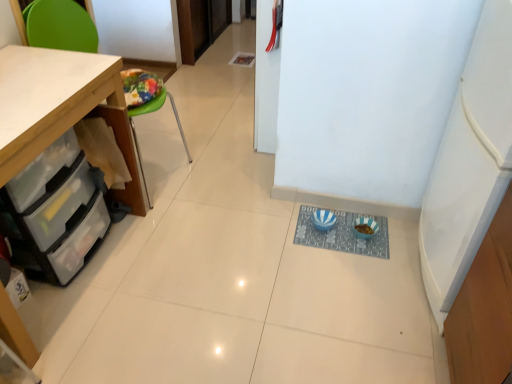
Describe the element at coordinates (342, 234) in the screenshot. The image size is (512, 384). I see `blue striped bowls at center` at that location.

What do you see at coordinates (59, 26) in the screenshot? This screenshot has width=512, height=384. I see `green plastic chair at left` at bounding box center [59, 26].

Locate an element on the screen. This screenshot has height=384, width=512. clear plastic drawers at lower left is located at coordinates (55, 212).

Image resolution: width=512 pixels, height=384 pixels. In order to click on blue striped bowls at center in this screenshot , I will do `click(342, 234)`.

Can you tell me how much wooden cabinet at left and clear plastic drawers at lower left differ in facing direction?

0.103 degrees.

Considering the sizes of objects wooden cabinet at left and clear plastic drawers at lower left in the image provided, who is wider, wooden cabinet at left or clear plastic drawers at lower left?

clear plastic drawers at lower left is wider.

Would you say wooden cabinet at left is a long distance from clear plastic drawers at lower left?

No.

The height and width of the screenshot is (384, 512). In order to click on drawer that is on the left side of wooden cabinet at left in this screenshot , I will do `click(55, 212)`.

Consider the image. Can you confirm if wooden cabinet at left is taller than green plastic chair at left?

No.

Which object is thinner, wooden cabinet at left or green plastic chair at left?

wooden cabinet at left.

You are a GUI agent. You are given a task and a screenshot of the screen. Output one action in this format:
    pyautogui.click(x=<x>, y=<y>)
    Task: Click on the chair behind the wooden cabinet at left
    This screenshot has height=384, width=512.
    Given the screenshot: What is the action you would take?
    pyautogui.click(x=59, y=26)

Is wooden cabinet at left not inside green plastic chair at left?

Indeed, wooden cabinet at left is completely outside green plastic chair at left.

Based on their positions, is blue striped bowls at center located to the left or right of clear plastic drawers at lower left?

Clearly, blue striped bowls at center is on the right of clear plastic drawers at lower left in the image.

Does blue striped bowls at center have a greater width compared to clear plastic drawers at lower left?

In fact, blue striped bowls at center might be narrower than clear plastic drawers at lower left.

From a real-world perspective, is blue striped bowls at center positioned above or below clear plastic drawers at lower left?

→ blue striped bowls at center is situated lower than clear plastic drawers at lower left in the real world.

Is green plastic chair at left positioned beyond the bounds of clear plastic drawers at lower left?

Yes, green plastic chair at left is located beyond the bounds of clear plastic drawers at lower left.

From a real-world perspective, which object stands above the other?

From a 3D spatial view, green plastic chair at left is above.

Where is `chair behind the clear plastic drawers at lower left`? chair behind the clear plastic drawers at lower left is located at coordinates (59, 26).

Which of these two, green plastic chair at left or clear plastic drawers at lower left, stands shorter?

With less height is clear plastic drawers at lower left.

Is wooden cabinet at left next to blue striped bowls at center and touching it?

No.

Can you confirm if wooden cabinet at left is bigger than blue striped bowls at center?

Yes.

Considering the sizes of objects wooden cabinet at left and blue striped bowls at center in the image provided, who is taller, wooden cabinet at left or blue striped bowls at center?

With more height is wooden cabinet at left.

From the image's perspective, between wooden cabinet at left and blue striped bowls at center, which one is located above?

From the image's view, wooden cabinet at left is above.

Is green plastic chair at left to the left or to the right of wooden cabinet at left in the image?

green plastic chair at left is positioned on wooden cabinet at left's right side.

Is point (74, 7) closer to camera compared to point (40, 65)?

No.

From a real-world perspective, is green plastic chair at left located higher than wooden cabinet at left?

Yes.

In the scene shown: Is green plastic chair at left aimed at wooden cabinet at left?

No, green plastic chair at left is not facing towards wooden cabinet at left.

From the image's perspective, is blue striped bowls at center above or below wooden cabinet at left?

blue striped bowls at center is situated lower than wooden cabinet at left in the image.

Is blue striped bowls at center bigger than wooden cabinet at left?

Actually, blue striped bowls at center might be smaller than wooden cabinet at left.

Considering the positions of objects blue striped bowls at center and wooden cabinet at left in the image provided, who is more to the left, blue striped bowls at center or wooden cabinet at left?

From the viewer's perspective, wooden cabinet at left appears more on the left side.

The width and height of the screenshot is (512, 384). Find the location of `cabinetry located on the right of clear plastic drawers at lower left`. cabinetry located on the right of clear plastic drawers at lower left is located at coordinates pos(55,102).

You are a GUI agent. You are given a task and a screenshot of the screen. Output one action in this format:
    pyautogui.click(x=<x>, y=<y>)
    Task: Click on the cabinetry in front of the green plastic chair at left
    The image size is (512, 384).
    Given the screenshot: What is the action you would take?
    pyautogui.click(x=55, y=102)

From the picture: When comparing their distances from green plastic chair at left, does wooden cabinet at left or blue striped bowls at center seem closer?

Among the two, wooden cabinet at left is located nearer to green plastic chair at left.

When comparing their distances from blue striped bowls at center, does green plastic chair at left or wooden cabinet at left seem closer?

wooden cabinet at left.

Estimate the real-world distances between objects in this image. Which object is closer to green plastic chair at left, clear plastic drawers at lower left or blue striped bowls at center?

Among the two, clear plastic drawers at lower left is located nearer to green plastic chair at left.

Based on their spatial positions, is blue striped bowls at center or wooden cabinet at left further from green plastic chair at left?

Based on the image, blue striped bowls at center appears to be further to green plastic chair at left.

Which object lies further to the anchor point clear plastic drawers at lower left, wooden cabinet at left or blue striped bowls at center?

Among the two, blue striped bowls at center is located further to clear plastic drawers at lower left.

Which object lies nearer to the anchor point blue striped bowls at center, clear plastic drawers at lower left or green plastic chair at left?

clear plastic drawers at lower left is closer to blue striped bowls at center.

Looking at the image, which one is located further to blue striped bowls at center, clear plastic drawers at lower left or wooden cabinet at left?

wooden cabinet at left.

Which object lies further to the anchor point wooden cabinet at left, green plastic chair at left or clear plastic drawers at lower left?

Based on the image, green plastic chair at left appears to be further to wooden cabinet at left.

Identify the location of cabinetry situated between clear plastic drawers at lower left and blue striped bowls at center from left to right. (55, 102).

In order to click on drawer between wooden cabinet at left and green plastic chair at left from front to back in this screenshot , I will do (x=55, y=212).

The image size is (512, 384). What are the coordinates of `chair between wooden cabinet at left and blue striped bowls at center from left to right` in the screenshot? It's located at (59, 26).

Identify the location of chair located between clear plastic drawers at lower left and blue striped bowls at center in the left-right direction. This screenshot has height=384, width=512. (59, 26).